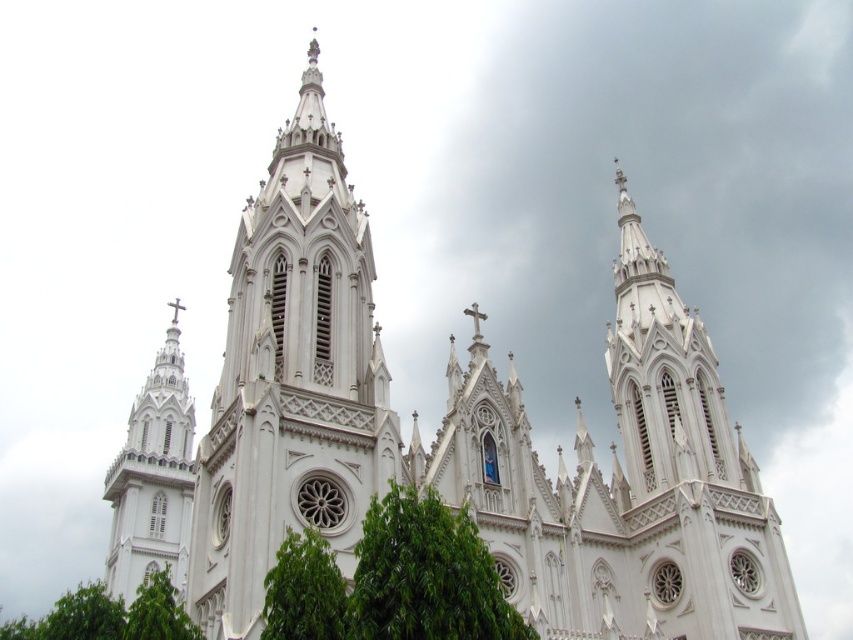
Is white stone church tower at center taller than white stone tower at left?

Indeed, white stone church tower at center has a greater height compared to white stone tower at left.

Who is higher up, white stone church tower at center or white stone tower at left?

white stone church tower at center is higher up.

Between point (264, 342) and point (120, 529), which one is positioned in front?

Positioned in front is point (264, 342).

You are a GUI agent. You are given a task and a screenshot of the screen. Output one action in this format:
    pyautogui.click(x=<x>, y=<y>)
    Task: Click on the white stone church tower at center
    The height and width of the screenshot is (640, 853).
    Given the screenshot: What is the action you would take?
    pyautogui.click(x=293, y=380)

Which is behind, point (642, 340) or point (136, 428)?

Positioned behind is point (136, 428).

Is white stone tower at center positioned in front of white stone tower at left?

Yes, it is.

This screenshot has height=640, width=853. In order to click on white stone tower at center in this screenshot , I will do `click(679, 474)`.

Where is `white stone church tower at center`? This screenshot has width=853, height=640. white stone church tower at center is located at coordinates (293, 380).